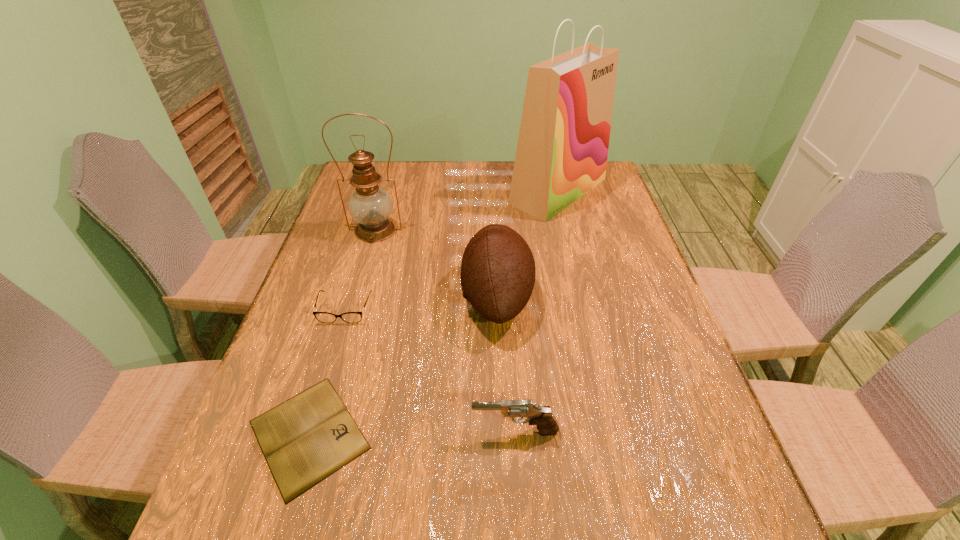
The image size is (960, 540). I want to click on blank region between the book and the second shortest object, so click(327, 372).

The image size is (960, 540). Identify the location of free space between the third shortest object and the tallest object. (537, 311).

Identify the location of empty location between the pistol and the spectacles. This screenshot has width=960, height=540. (430, 370).

The height and width of the screenshot is (540, 960). Find the location of `vacant point located between the second shortest object and the tallest object`. vacant point located between the second shortest object and the tallest object is located at coordinates (451, 250).

You are a GUI agent. You are given a task and a screenshot of the screen. Output one action in this format:
    pyautogui.click(x=<x>, y=<y>)
    Task: Click on the free area in between the book and the third shortest object
    This screenshot has height=540, width=960.
    Given the screenshot: What is the action you would take?
    pyautogui.click(x=412, y=433)

Locate which object ranks fifth in proximity to the football. Please provide its 2D coordinates. Your answer should be formatted as a tuple, i.e. [(x, y)], where the tuple contains the x and y coordinates of a point satisfying the conditions above.

[(324, 317)]

The image size is (960, 540). Find the location of `object identified as the fifth closest to the fourth shortest object`. object identified as the fifth closest to the fourth shortest object is located at coordinates (324, 317).